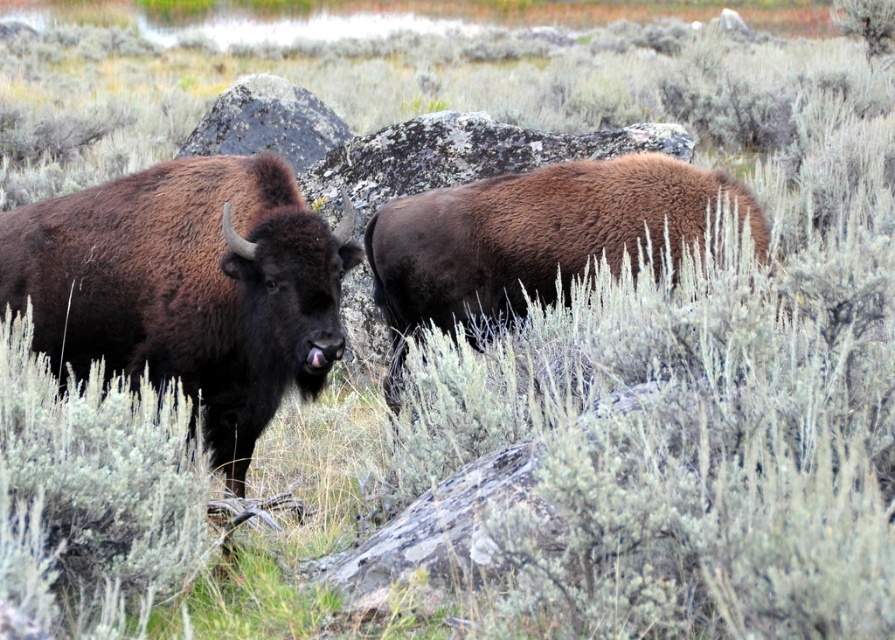
You are a wildlife photographer trying to capture both bison in a single frame. The brown fuzzy buffalo at left is represented by point (186, 288). Where should you position your camera to ensure both bison are in the frame?

To capture both bison in the frame, position the camera so that the point (186, 288) representing the brown fuzzy buffalo at left is within the camera viewfinder, ensuring the other bison is also visible.